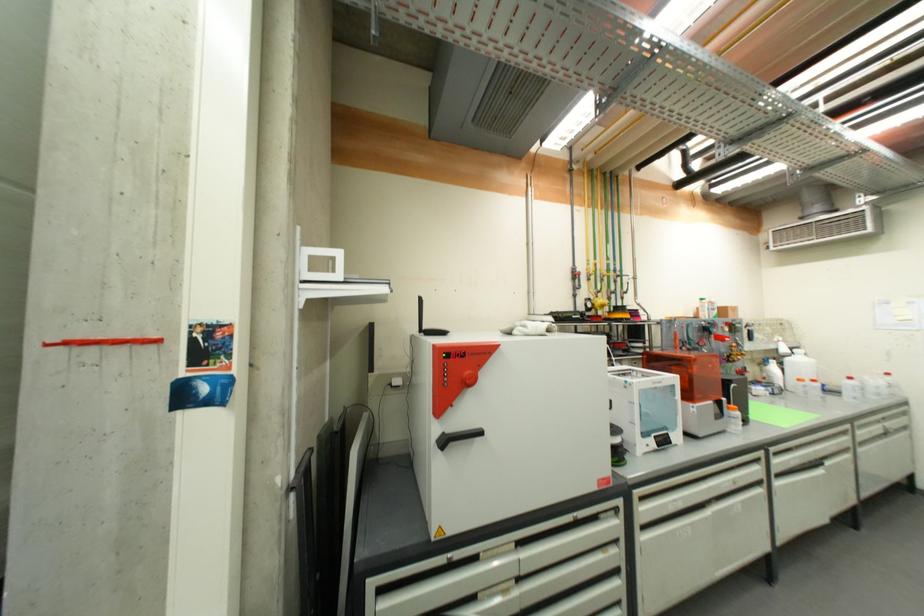
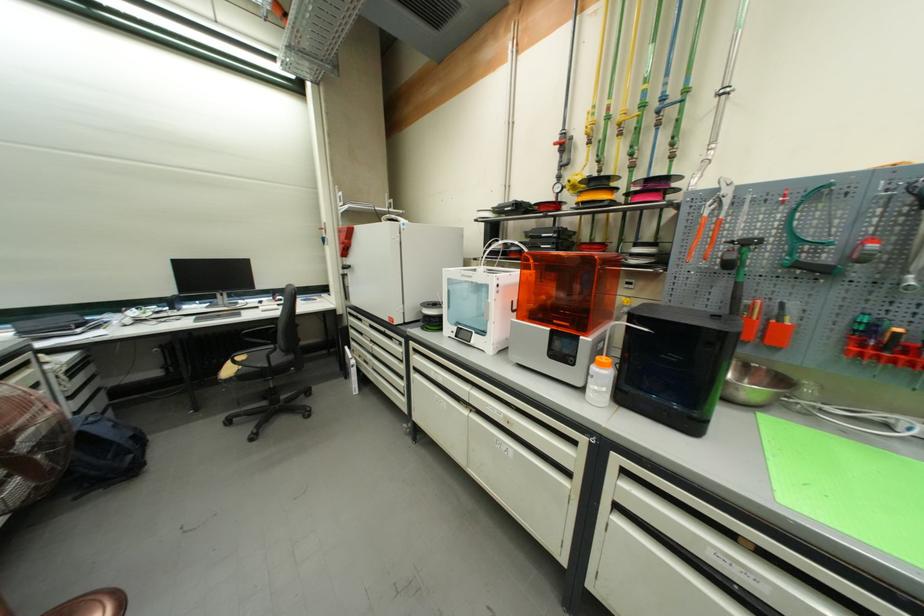
Find the pixel in the second image that matches pixel 739 411 in the first image.

(606, 367)